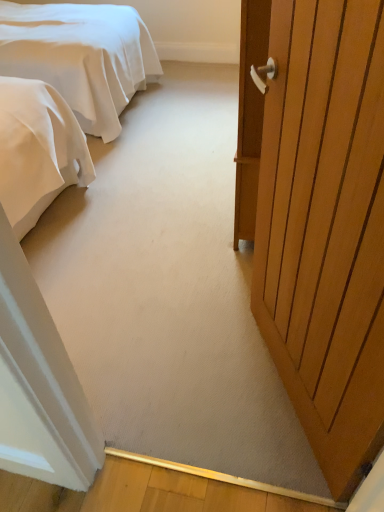
Identify the location of wooden door at right. (325, 226).

The width and height of the screenshot is (384, 512). What do you see at coordinates (325, 226) in the screenshot?
I see `wooden door at right` at bounding box center [325, 226].

Describe the element at coordinates (80, 56) in the screenshot. The image size is (384, 512). I see `white satin bed at upper left` at that location.

Find the location of a particular element. This screenshot has width=384, height=512. white satin bed at upper left is located at coordinates (80, 56).

Locate an element on the screen. The image size is (384, 512). wooden door at right is located at coordinates (325, 226).

Visually, is wooden door at right positioned to the left or to the right of white satin bed at upper left?

Based on their positions, wooden door at right is located to the right of white satin bed at upper left.

Is wooden door at right behind white satin bed at upper left?

No, wooden door at right is in front of white satin bed at upper left.

Considering the points (321, 426) and (12, 16), which point is behind, point (321, 426) or point (12, 16)?

The point (12, 16) is farther.

From the image's perspective, relative to white satin bed at upper left, is wooden door at right above or below?

Clearly, from the image's perspective, wooden door at right is below white satin bed at upper left.

From a real-world perspective, relative to white satin bed at upper left, is wooden door at right vertically above or below?

From a real-world perspective, wooden door at right is physically above white satin bed at upper left.

Considering the relative sizes of wooden door at right and white satin bed at upper left in the image provided, is wooden door at right thinner than white satin bed at upper left?

Yes.

Does wooden door at right have a greater height compared to white satin bed at upper left?

Indeed, wooden door at right has a greater height compared to white satin bed at upper left.

Can you confirm if wooden door at right is bigger than white satin bed at upper left?

Actually, wooden door at right might be smaller than white satin bed at upper left.

Based on the photo, is wooden door at right outside of white satin bed at upper left?

Absolutely, wooden door at right is external to white satin bed at upper left.

Is wooden door at right far from white satin bed at upper left?

That's right, there is a large distance between wooden door at right and white satin bed at upper left.

Is wooden door at right positioned with its back to white satin bed at upper left?

No, wooden door at right's orientation is not away from white satin bed at upper left.

Find the location of a particular element. bed that is above the wooden door at right (from the image's perspective) is located at coordinates (80, 56).

Consider the image. Based on their positions, is white satin bed at upper left located to the left or right of wooden door at right?

In the image, white satin bed at upper left appears on the left side of wooden door at right.

Which object is more forward, white satin bed at upper left or wooden door at right?

wooden door at right is in front.

Is point (41, 24) positioned in front of point (329, 184)?

No, it is behind (329, 184).

From the image's perspective, is white satin bed at upper left positioned above or below wooden door at right?

white satin bed at upper left is situated higher than wooden door at right in the image.

From a real-world perspective, which is physically above, white satin bed at upper left or wooden door at right?

wooden door at right is physically above.

Considering the relative sizes of white satin bed at upper left and wooden door at right in the image provided, is white satin bed at upper left wider than wooden door at right?

Correct, the width of white satin bed at upper left exceeds that of wooden door at right.

Who is taller, white satin bed at upper left or wooden door at right?

With more height is wooden door at right.

Considering the relative sizes of white satin bed at upper left and wooden door at right in the image provided, is white satin bed at upper left bigger than wooden door at right?

Yes.

Is white satin bed at upper left not inside wooden door at right?

white satin bed at upper left lies outside wooden door at right's area.

Is white satin bed at upper left far from wooden door at right?

Yes, white satin bed at upper left and wooden door at right are located far from each other.

Is white satin bed at upper left positioned with its back to wooden door at right?

No, wooden door at right is not at the back of white satin bed at upper left.

The width and height of the screenshot is (384, 512). I want to click on bed on the left side of wooden door at right, so click(80, 56).

In order to click on bed that appears below the wooden door at right (from a real-world perspective) in this screenshot , I will do `click(80, 56)`.

Find the location of a particular element. door below the white satin bed at upper left (from the image's perspective) is located at coordinates (325, 226).